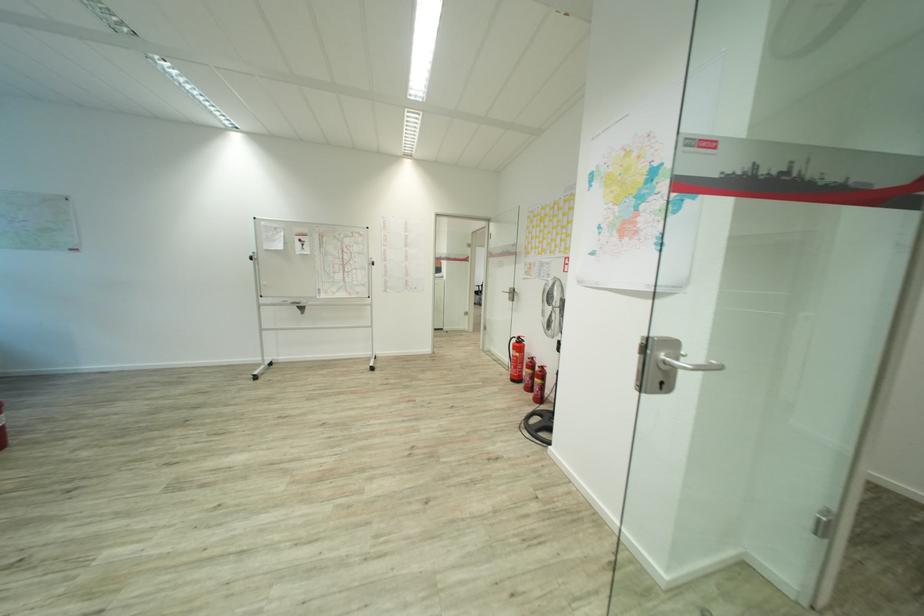
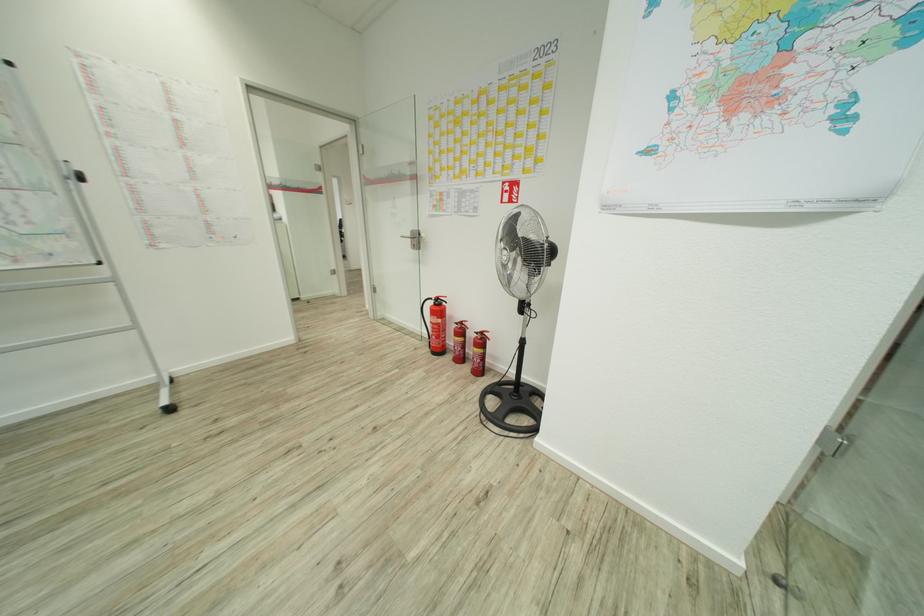
The point at (541,367) is marked in the first image. Where is the corresponding point in the second image?

(480, 331)